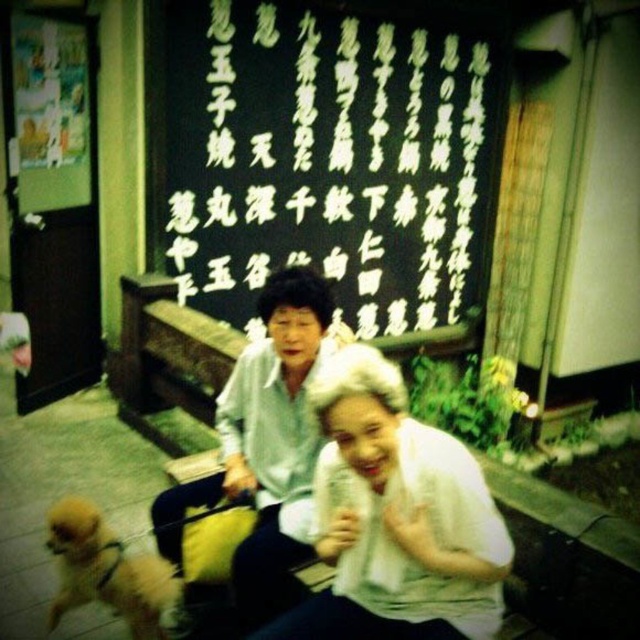
Question: Does black matte signboard at upper center appear over white sheer fabric at center?

Choices:
 (A) yes
 (B) no

Answer: (A)

Question: Estimate the real-world distances between objects in this image. Which object is farther from the golden fur dog at lower left?

Choices:
 (A) white matte shirt at center
 (B) black matte signboard at upper center
 (C) white sheer fabric at center

Answer: (B)

Question: Can you confirm if black matte signboard at upper center is bigger than white sheer fabric at center?

Choices:
 (A) yes
 (B) no

Answer: (A)

Question: Does black matte signboard at upper center appear over golden fur dog at lower left?

Choices:
 (A) yes
 (B) no

Answer: (A)

Question: Which of the following is the closest to the observer?

Choices:
 (A) white matte shirt at center
 (B) white sheer fabric at center
 (C) black matte signboard at upper center
 (D) golden fur dog at lower left

Answer: (B)

Question: Which of these objects is positioned farthest from the white matte shirt at center?

Choices:
 (A) golden fur dog at lower left
 (B) white sheer fabric at center
 (C) black matte signboard at upper center

Answer: (C)